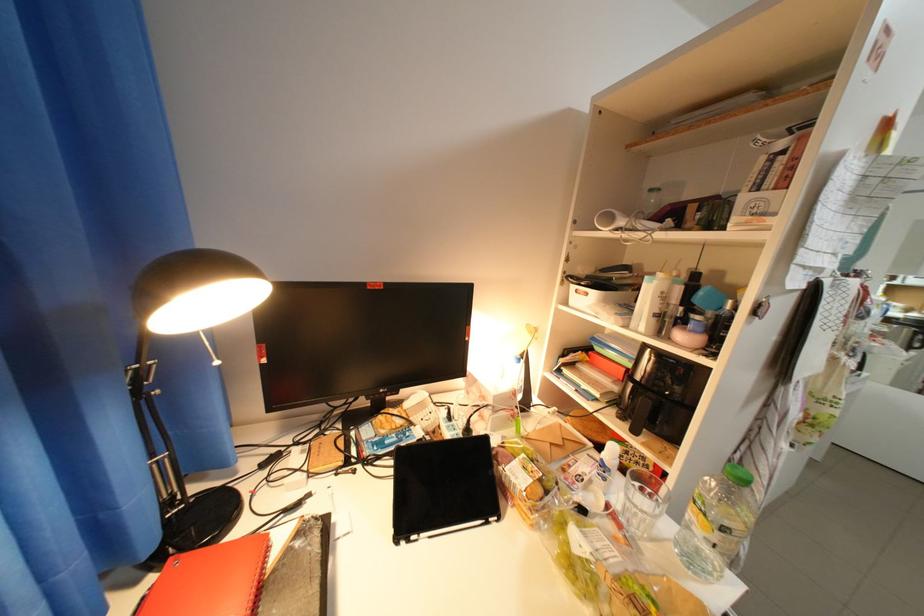
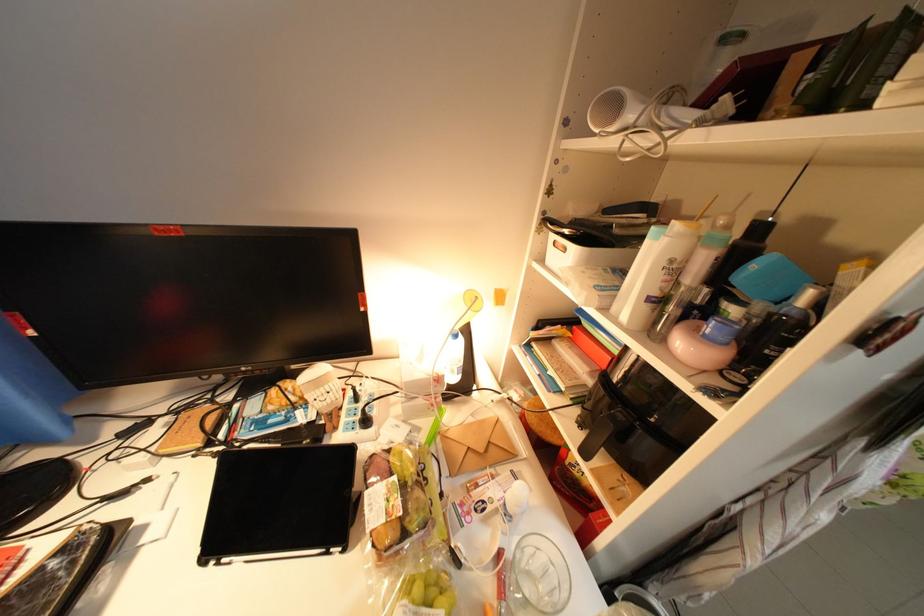
Locate, in the second image, the point that corresponds to pixel 743 302 in the first image.

(822, 294)